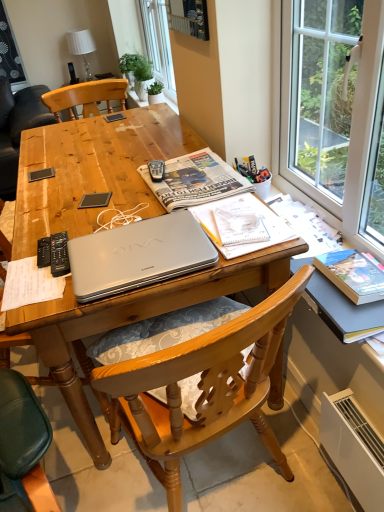
The image size is (384, 512). Find the location of `vacant region above silver metallic laptop at center (from a real-world perspective)`. vacant region above silver metallic laptop at center (from a real-world perspective) is located at coordinates (129, 244).